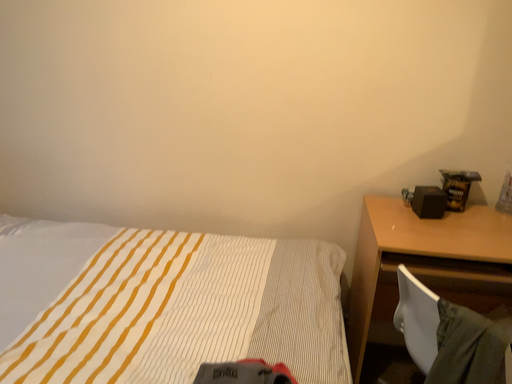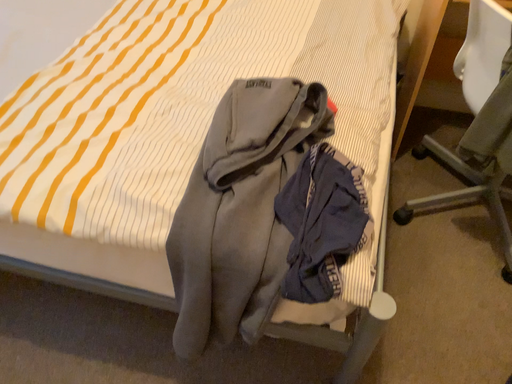
Question: Which way did the camera rotate in the video?

Choices:
 (A) rotated right
 (B) rotated left

Answer: (B)